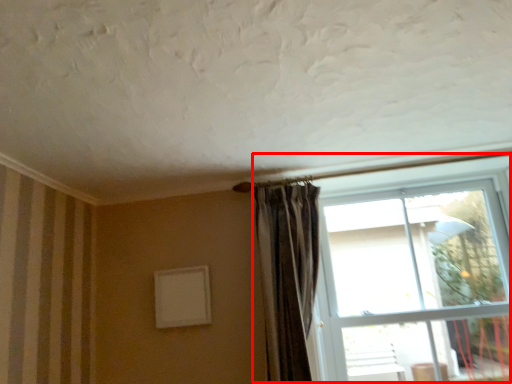
Question: Considering the relative positions of window (annotated by the red box) and curtain in the image provided, where is window (annotated by the red box) located with respect to the staircase?

Choices:
 (A) right
 (B) left

Answer: (A)